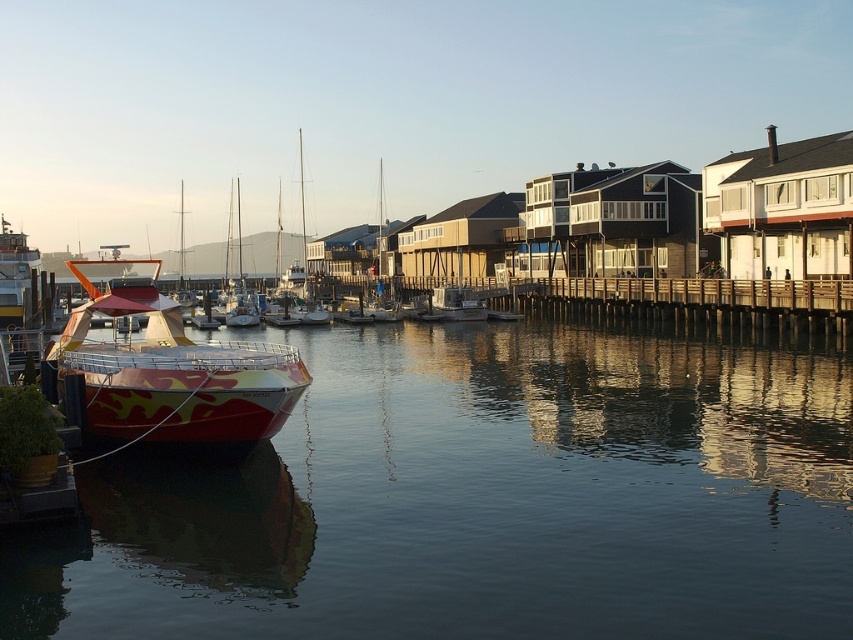
Is wooden at right above shiny white sailboat at center?

Incorrect, wooden at right is not positioned above shiny white sailboat at center.

Between wooden at right and shiny white sailboat at center, which one appears on the right side from the viewer's perspective?

Positioned to the right is wooden at right.

What do you see at coordinates (705, 298) in the screenshot? I see `wooden at right` at bounding box center [705, 298].

You are a GUI agent. You are given a task and a screenshot of the screen. Output one action in this format:
    pyautogui.click(x=<x>, y=<y>)
    Task: Click on the wooden at right
    This screenshot has width=853, height=640.
    Given the screenshot: What is the action you would take?
    pyautogui.click(x=705, y=298)

Which is above, wooden at right or white glossy boat at center?

wooden at right

Between point (624, 291) and point (459, 292), which one is positioned in front?

Point (624, 291) is more forward.

The width and height of the screenshot is (853, 640). Find the location of `wooden at right`. wooden at right is located at coordinates (705, 298).

How distant is glossy water at lower left from wooden at right?

glossy water at lower left is 68.78 feet from wooden at right.

Can you confirm if glossy water at lower left is bigger than wooden at right?

Incorrect, glossy water at lower left is not larger than wooden at right.

Is point (114, 604) closer to viewer compared to point (839, 326)?

Yes, it is in front of point (839, 326).

What are the coordinates of `glossy water at lower left` in the screenshot? It's located at (479, 499).